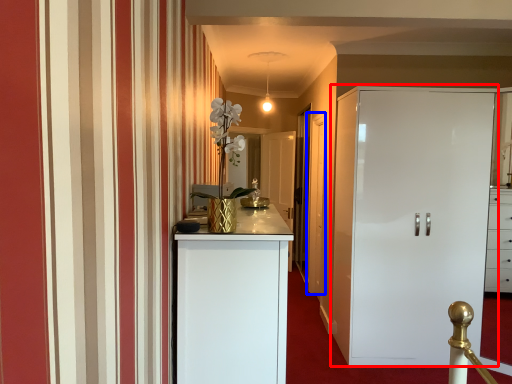
Question: Among these objects, which one is farthest to the camera, cupboard (highlighted by a red box) or door (highlighted by a blue box)?

Choices:
 (A) cupboard
 (B) door

Answer: (B)